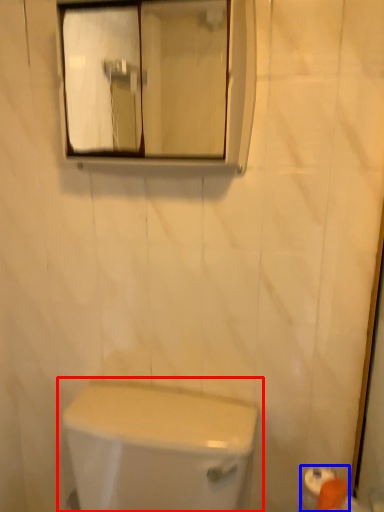
Question: Which object is further to the camera taking this photo, toilet (highlighted by a red box) or toilet paper (highlighted by a blue box)?

Choices:
 (A) toilet
 (B) toilet paper

Answer: (B)